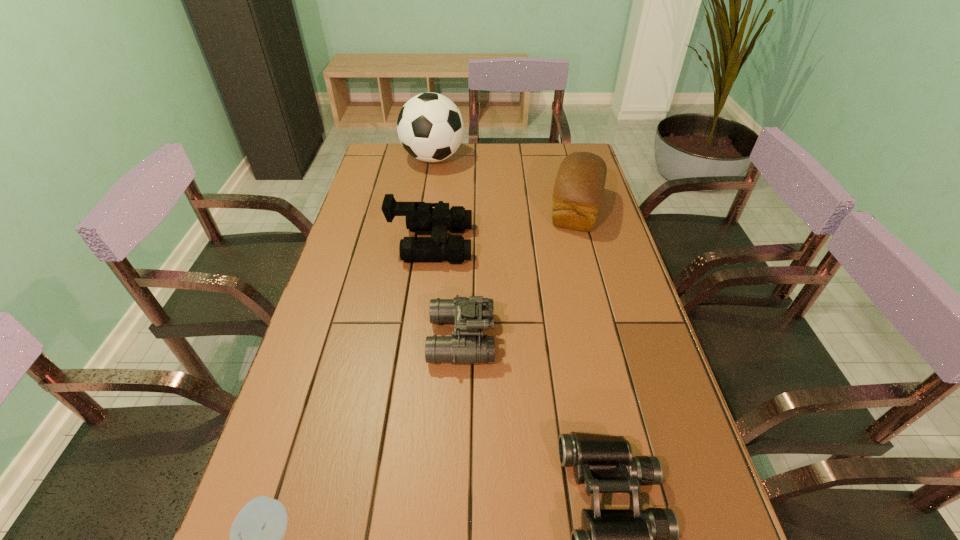
This screenshot has height=540, width=960. I want to click on object that is positioned at the far edge, so click(x=430, y=126).

The height and width of the screenshot is (540, 960). I want to click on soccer ball at the left edge, so click(x=430, y=126).

Find the location of a particular element. binoculars situated at the left edge is located at coordinates (421, 218).

The height and width of the screenshot is (540, 960). I want to click on object positioned at the right edge, so click(x=579, y=186).

Find the location of a particular element. object situated at the far left corner is located at coordinates (x=430, y=126).

In the image, there is a desktop. Identify the location of vacant area at the far edge. (462, 167).

Locate an element on the screen. The height and width of the screenshot is (540, 960). blank space at the left edge is located at coordinates (333, 415).

The height and width of the screenshot is (540, 960). In the image, there is a desktop. Find the location of `vacant region at the right edge`. vacant region at the right edge is located at coordinates (604, 208).

The height and width of the screenshot is (540, 960). I want to click on empty location between the tallest object and the bread, so click(x=505, y=184).

What are the coordinates of `free space between the soccer ball and the farthest binoculars` in the screenshot? It's located at (432, 201).